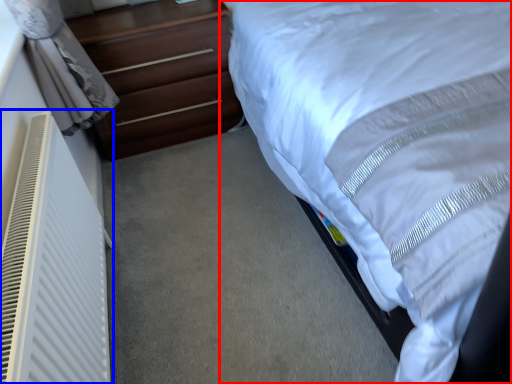
Question: Which of the following is the farthest to the observer, bed (highlighted by a red box) or air conditioner (highlighted by a blue box)?

Choices:
 (A) bed
 (B) air conditioner

Answer: (B)